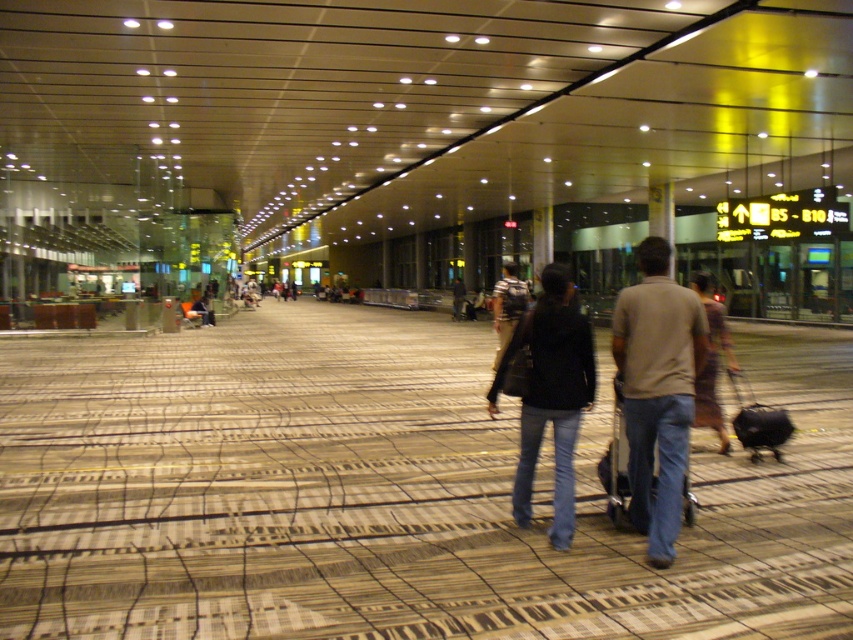
You are an airport security officer observing two travelers in the corridor. The beige cotton shirt at center and the black leather jacket at center are both in your line of sight. Which traveler is shorter in height?

The beige cotton shirt at center is shorter in height compared to the black leather jacket at center.

You are a security guard in the airport corridor. You need to check both the dark brown leather jacket at center and the dark brown dress at center. Which one should you check first if you want to minimize the distance walked?

You should check the dark brown leather jacket at center first because it is closer to your starting position. Since both items are at the center, but the jacket is 4.62 feet away from the dress, you can choose the nearest one based on your current location. However, without knowing your exact starting point, it is impossible to determine which is closer. Please clarify your position.